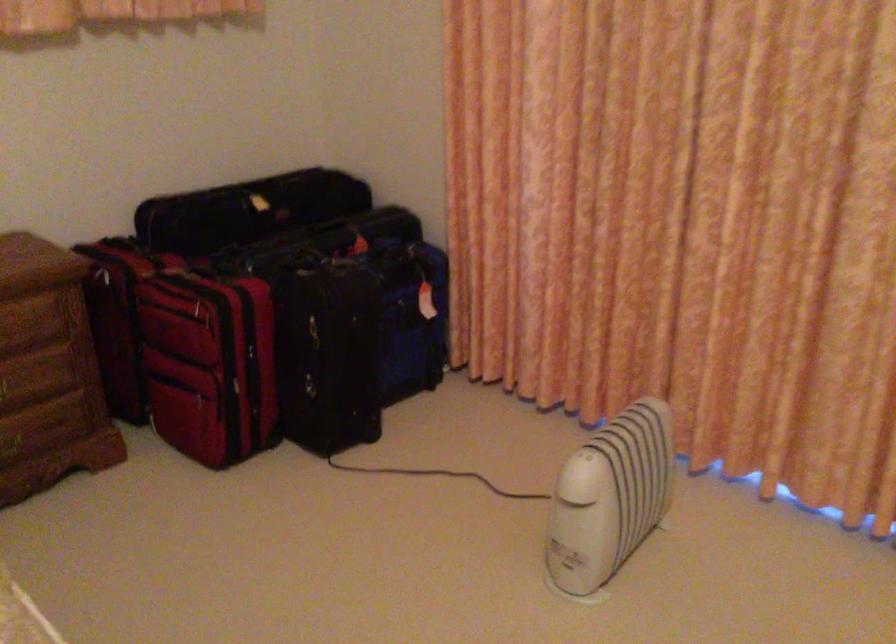
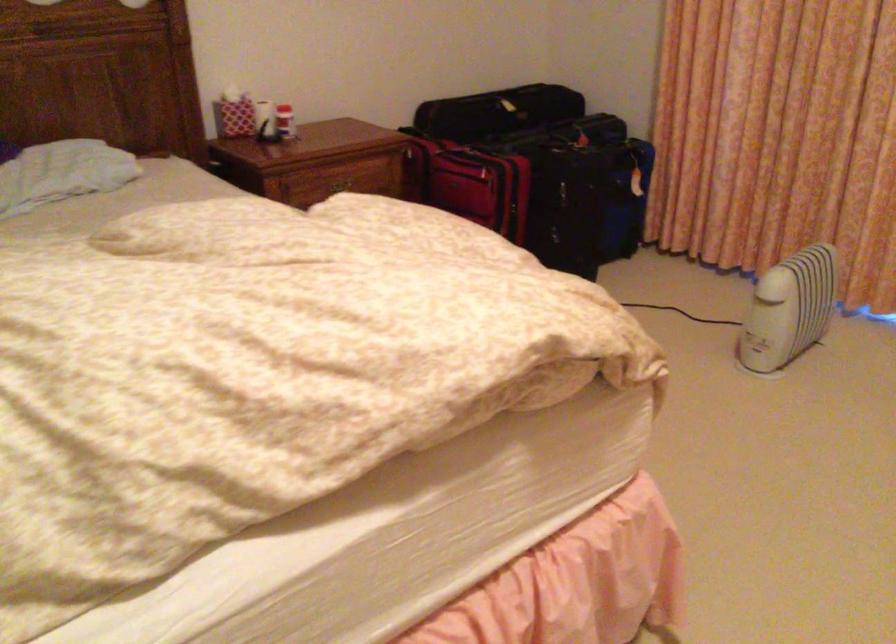
The point at (449,357) is marked in the first image. Where is the corresponding point in the second image?

(649, 223)